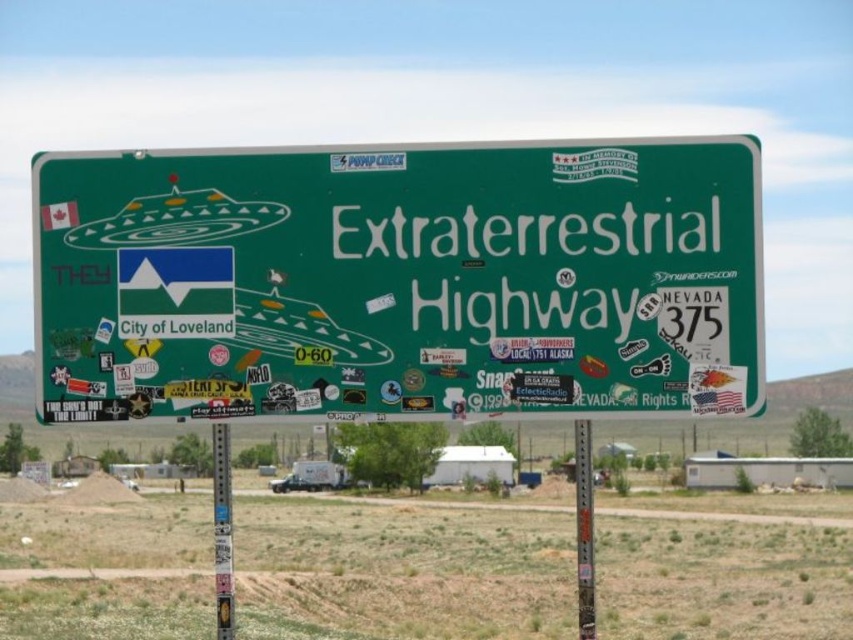
Question: Which point is farther to the camera?

Choices:
 (A) coord(590,602)
 (B) coord(218,492)

Answer: (B)

Question: Is green matte highway sign at center above metallic pole at lower center?

Choices:
 (A) yes
 (B) no

Answer: (A)

Question: Which of the following is the farthest from the observer?

Choices:
 (A) (630, 212)
 (B) (222, 484)

Answer: (B)

Question: Which point is farther from the camera taking this photo?

Choices:
 (A) (231, 580)
 (B) (585, 509)
 (C) (354, 310)

Answer: (B)

Question: Can you confirm if green matte highway sign at center is positioned above green painted metal pole at center?

Choices:
 (A) no
 (B) yes

Answer: (B)

Question: Is metallic pole at lower center wider than green painted metal pole at center?

Choices:
 (A) no
 (B) yes

Answer: (B)